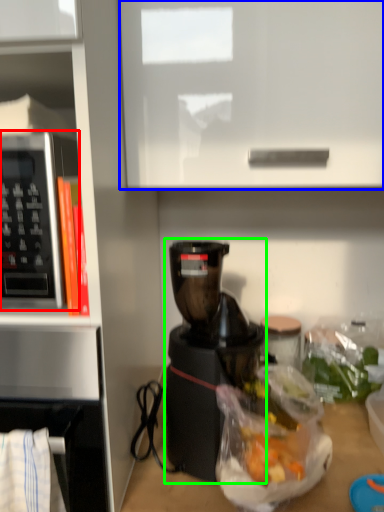
Question: Which is farther away from microwave oven (highlighted by a red box)? cabinetry (highlighted by a blue box) or coffee maker (highlighted by a green box)?

Choices:
 (A) cabinetry
 (B) coffee maker

Answer: (B)